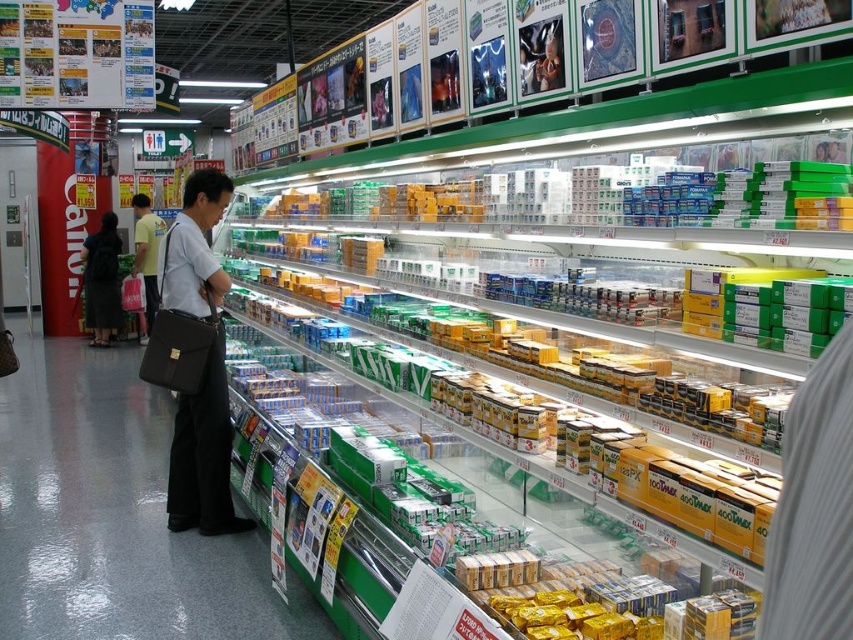
You are organizing a clothing rack in a store and need to place the dark gray dress at center and the light blue shirt at center. Given their sizes, which item should you place first to maximize space efficiency?

The dark gray dress at center occupies less space than the light blue shirt at center, so you should place the light blue shirt at center first to make room for the smaller item afterward.